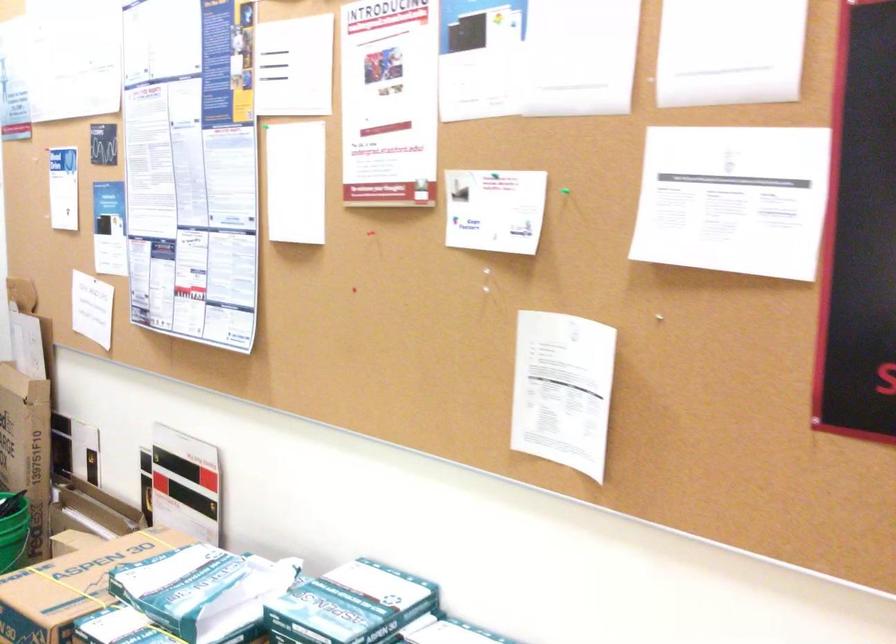
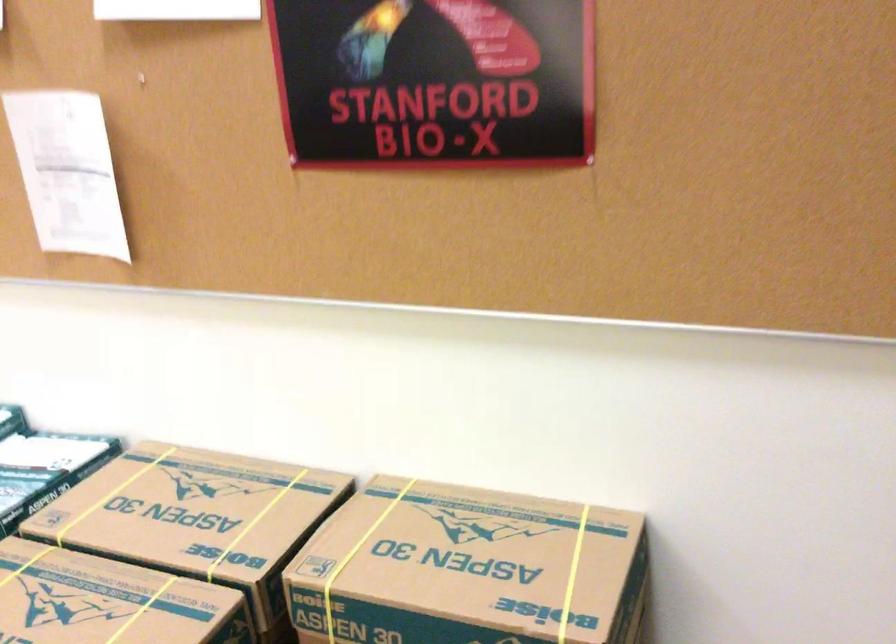
Where in the second image is the point corresponding to (659,313) from the first image?

(141, 79)